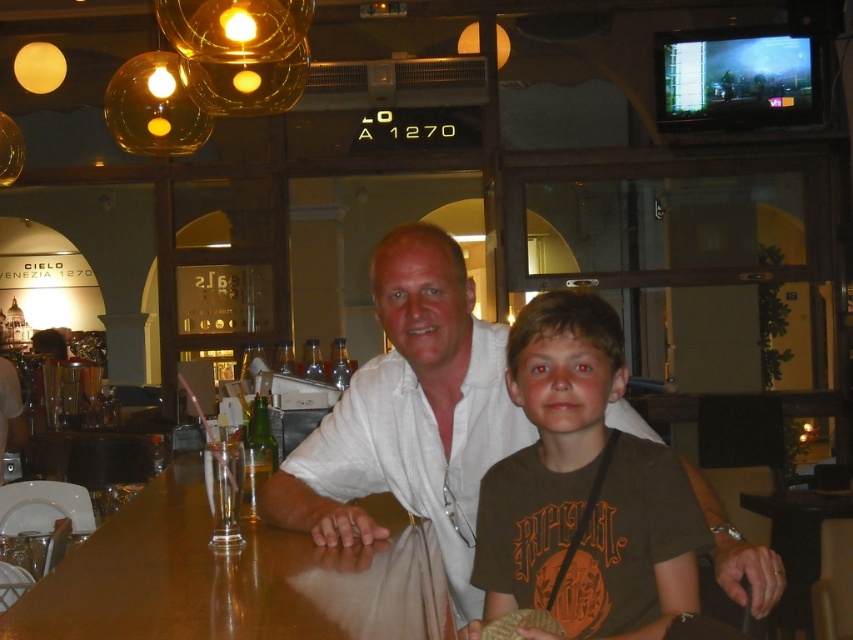
Question: Which object appears farthest from the camera in this image?

Choices:
 (A) brown cotton t-shirt at center
 (B) shiny brown wood table at center
 (C) white cotton shirt at center

Answer: (C)

Question: Is white cotton shirt at center positioned in front of shiny brown wood table at center?

Choices:
 (A) yes
 (B) no

Answer: (B)

Question: Is brown cotton t-shirt at center to the right of shiny brown wood table at center from the viewer's perspective?

Choices:
 (A) yes
 (B) no

Answer: (A)

Question: Which object is positioned farthest from the white cotton shirt at center?

Choices:
 (A) shiny brown wood table at center
 (B) brown cotton t-shirt at center

Answer: (A)

Question: Can you confirm if brown cotton t-shirt at center is positioned below shiny brown wood table at center?

Choices:
 (A) yes
 (B) no

Answer: (B)

Question: Which object appears farthest from the camera in this image?

Choices:
 (A) shiny brown wood table at center
 (B) brown cotton t-shirt at center
 (C) white cotton shirt at center

Answer: (C)